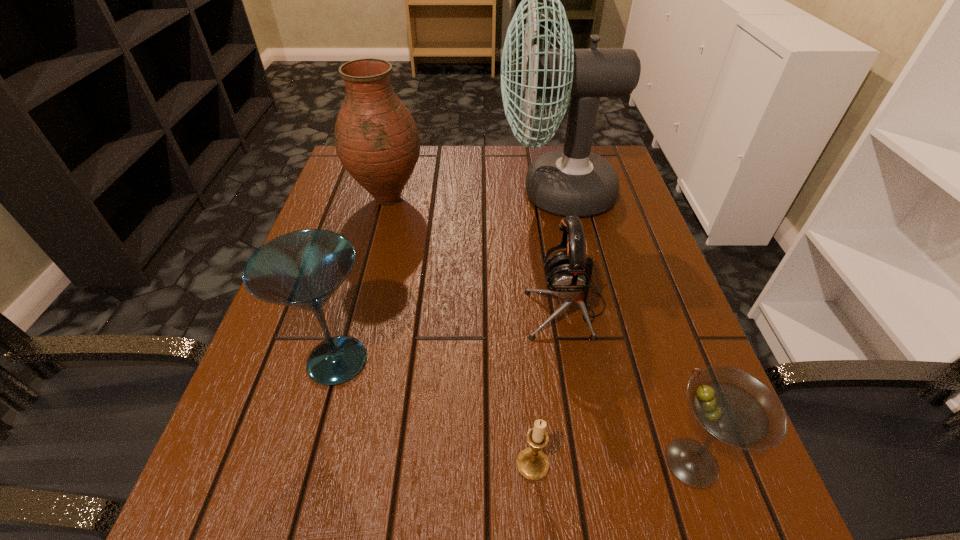
In the image, there is a desktop. Identify the location of vacant space at the near left corner. (192, 524).

Identify the location of vacant area at the far right corner. (602, 156).

Identify the location of vacant area between the farther martini and the shorter martini. The image size is (960, 540). (515, 411).

Identify the location of free space between the fifth shortest object and the taller martini. This screenshot has width=960, height=540. (363, 280).

Locate an element on the screen. The width and height of the screenshot is (960, 540). free space between the earphone and the taller martini is located at coordinates (451, 334).

Where is `free area in between the earphone and the right martini`? The image size is (960, 540). free area in between the earphone and the right martini is located at coordinates (629, 385).

At what (x,y) coordinates should I click in order to perform the action: click on empty space that is in between the earphone and the farther martini. Please return your answer as a coordinate pair (x, y). This screenshot has width=960, height=540. Looking at the image, I should click on (451, 334).

Find the location of a particular element. The image size is (960, 540). free spot between the tallest object and the left martini is located at coordinates (446, 276).

Find the location of a particular element. Image resolution: width=960 pixels, height=540 pixels. vacant space that's between the fifth shortest object and the tallest object is located at coordinates (472, 195).

Locate an element on the screen. The height and width of the screenshot is (540, 960). free space between the left martini and the earphone is located at coordinates (451, 334).